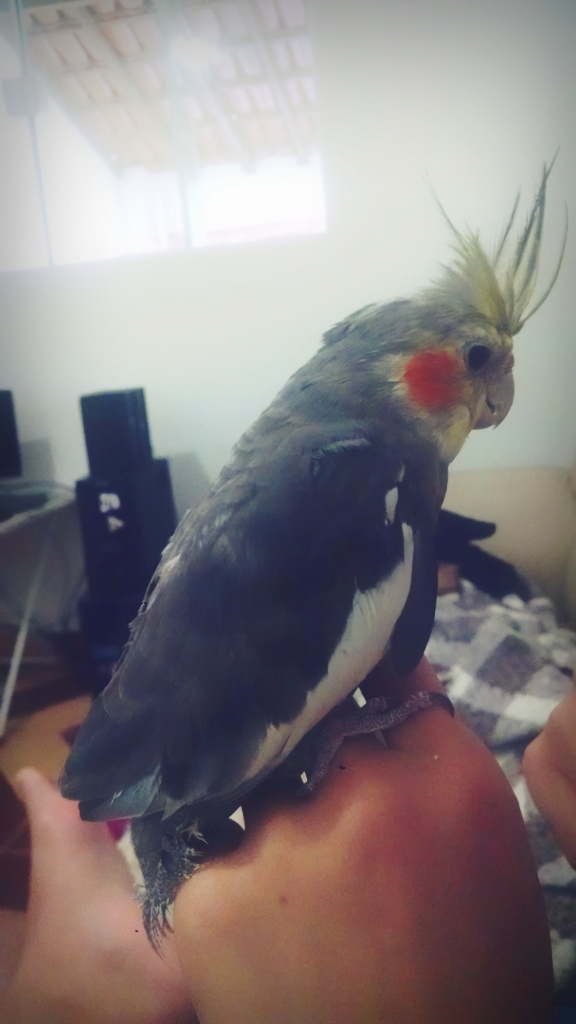
Image resolution: width=576 pixels, height=1024 pixels. I want to click on white fur, so click(363, 642).